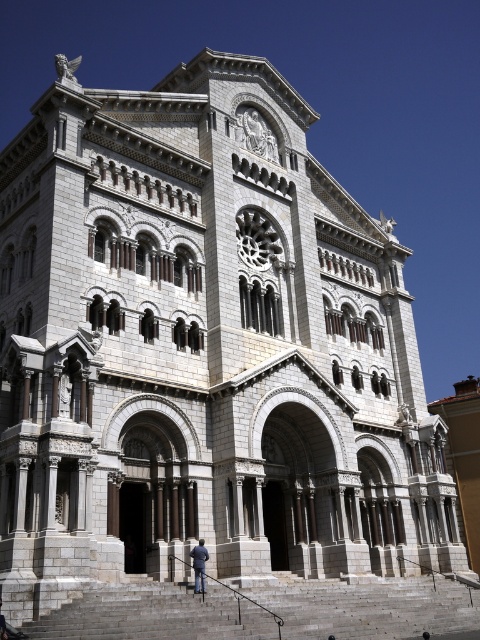
Does gray stone stairs at lower center appear under blue jeans at lower center?

Yes.

Measure the distance between gray stone stairs at lower center and camera.

gray stone stairs at lower center and camera are 31.83 meters apart from each other.

Who is more forward, (159, 595) or (203, 547)?

Point (159, 595) is in front.

This screenshot has height=640, width=480. I want to click on gray stone stairs at lower center, so click(371, 608).